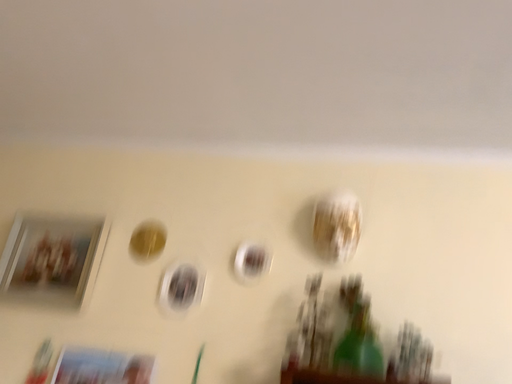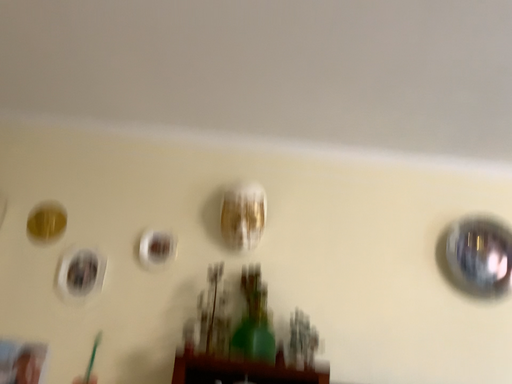
Question: Which way did the camera rotate in the video?

Choices:
 (A) rotated right
 (B) rotated left

Answer: (A)